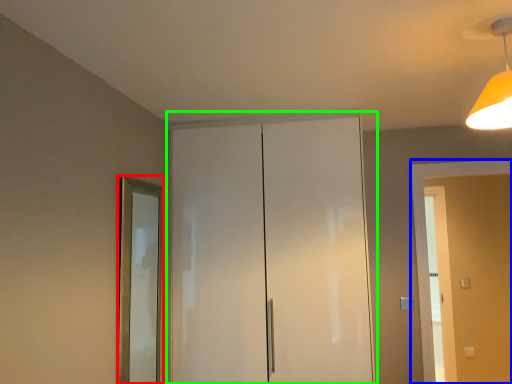
Question: Which object is positioned closest to mirror (highlighted by a red box)? Select from screen door (highlighted by a blue box) and dresser (highlighted by a green box).

Choices:
 (A) screen door
 (B) dresser

Answer: (B)